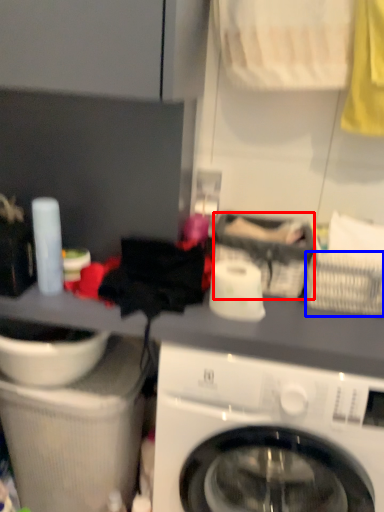
Question: Among these objects, which one is nearest to the camera, basket (highlighted by a red box) or basket (highlighted by a blue box)?

Choices:
 (A) basket
 (B) basket

Answer: (B)